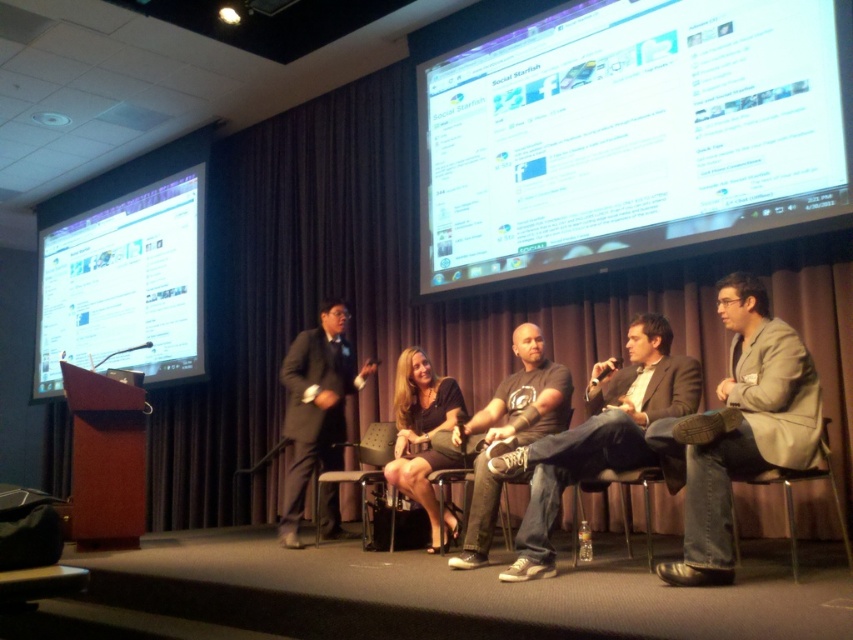
Question: Is matte black screen at left further to the viewer compared to metallic silver chair at lower right?

Choices:
 (A) no
 (B) yes

Answer: (B)

Question: Does dark gray cotton t-shirt at center have a lesser width compared to metallic silver chair at lower center?

Choices:
 (A) no
 (B) yes

Answer: (A)

Question: Which point is farther to the camera?

Choices:
 (A) (645, 512)
 (B) (665, 346)
 (C) (364, 484)
 (D) (780, 390)

Answer: (C)

Question: Which object is farther from the camera taking this photo?

Choices:
 (A) black fabric skirt at center
 (B) dark gray cotton t-shirt at center
 (C) matte gray chair at center

Answer: (C)

Question: Estimate the real-world distances between objects in this image. Which object is farther from the matte black screen at left?

Choices:
 (A) dark gray t-shirt at center
 (B) white glossy screen at upper center
 (C) metallic silver chair at lower center

Answer: (C)

Question: Does black fabric skirt at center appear on the left side of matte gray chair at center?

Choices:
 (A) yes
 (B) no

Answer: (B)